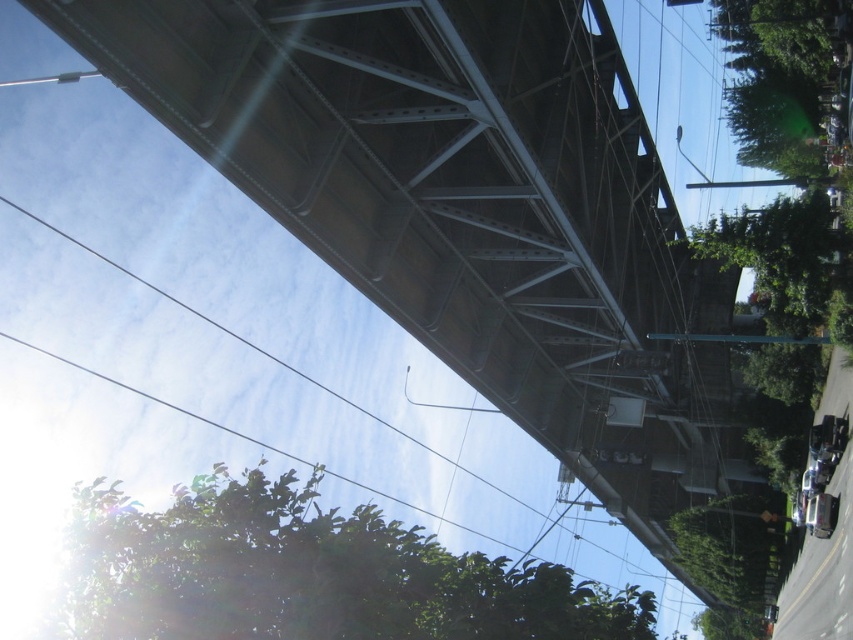
You are standing at the camera position and want to take a photo of the shiny black car at lower right. The camera has a maximum focus range of 40 meters. Will the car be in focus?

The shiny black car at lower right is 39.78 meters from the camera, which is within the maximum focus range of 40 meters. Therefore, the car will be in focus.

You are standing under the bridge and looking up. There are two points marked on the bridge structure at coordinates point (814, 518) and point (772, 529). Which point is closer to your eyes?

Point (814, 518) is closer to the viewer than point (772, 529).

You are a delivery person standing at the edge of the bridge. You need to place a package on the green matte skateboard at lower right. However, there is a shiny black car at lower right blocking your path. Can you still reach the skateboard without moving the car?

The shiny black car at lower right is positioned over the green matte skateboard at lower right, so the car is directly blocking the skateboard. You cannot reach the skateboard without moving the car.